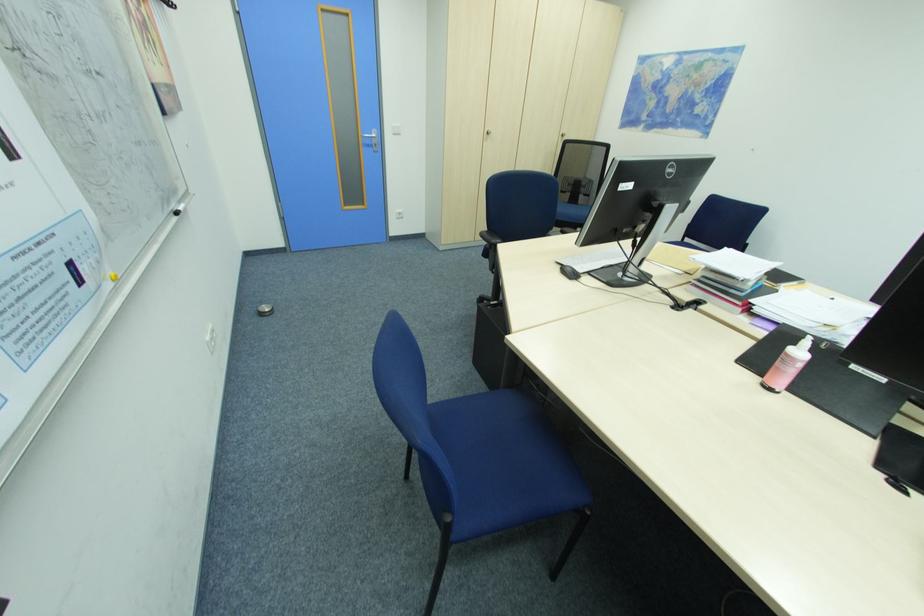
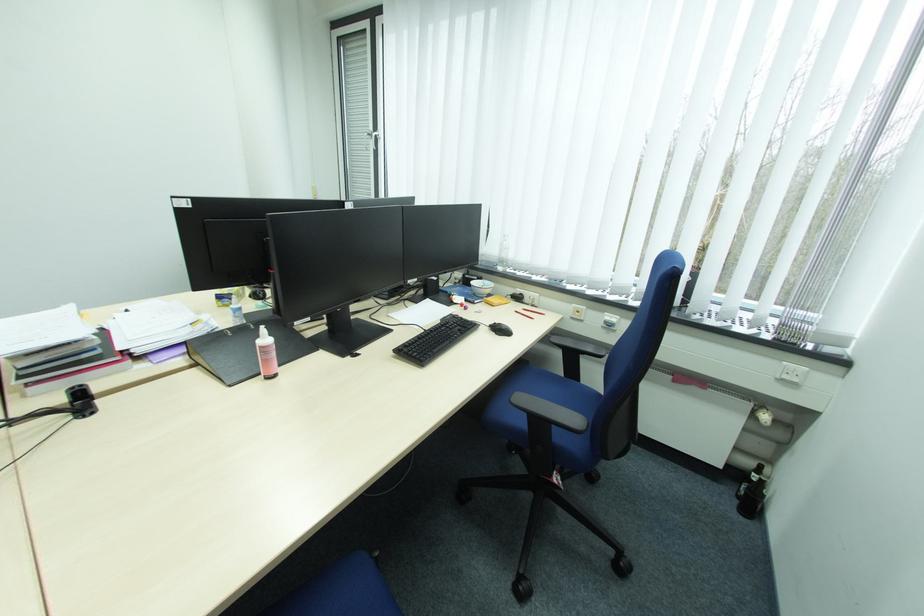
From the picture: How did the camera likely rotate?

The camera rotated toward right-down.